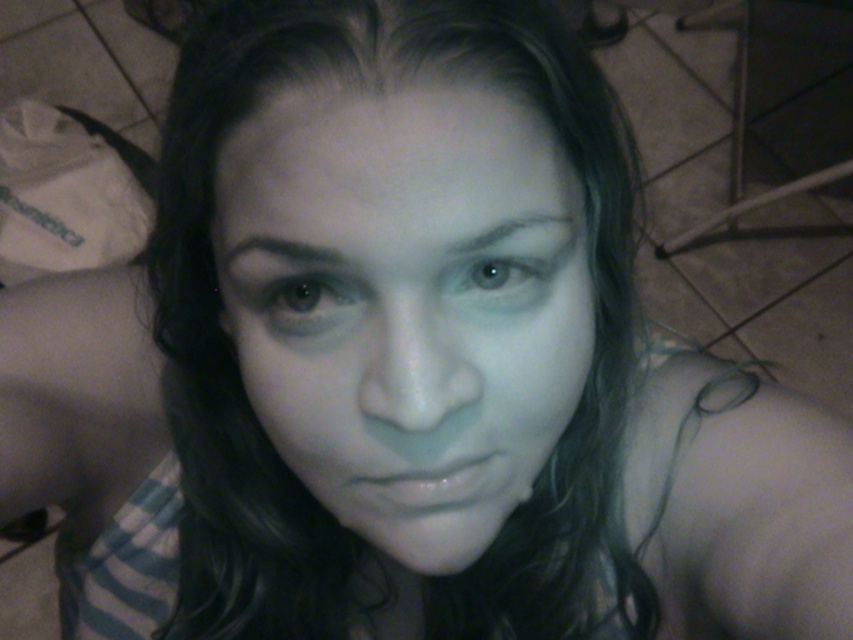
Question: Does dark brown hair at upper center appear on the right side of blue glossy eye at center?

Choices:
 (A) yes
 (B) no

Answer: (B)

Question: Can you confirm if brown matte eye at center is bigger than blue glossy eye at center?

Choices:
 (A) no
 (B) yes

Answer: (B)

Question: Which point is farther to the camera?

Choices:
 (A) gray matte eyebrow at upper center
 (B) brown matte eye at center
 (C) blue glossy eye at center
 (D) smooth skin face at center

Answer: (C)

Question: Is brown matte eye at center below dark brown hair at upper center?

Choices:
 (A) yes
 (B) no

Answer: (A)

Question: Which of the following is the closest to the observer?

Choices:
 (A) dark brown hair at upper center
 (B) smooth skin face at center
 (C) brown matte eye at center

Answer: (B)

Question: Among these objects, which one is farthest from the camera?

Choices:
 (A) smooth skin face at center
 (B) gray matte eyebrow at upper center
 (C) dark brown hair at upper center
 (D) brown matte eye at center

Answer: (D)